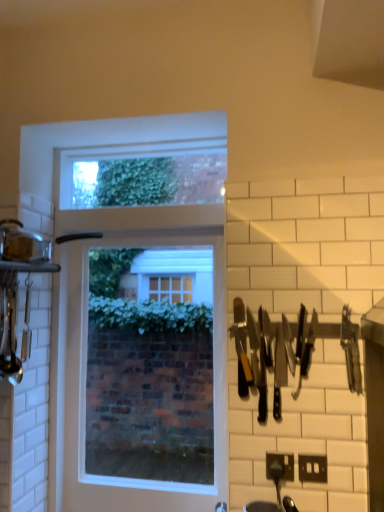
Question: Is black plastic electric outlet at lower right at the left side of black plastic knives at right?

Choices:
 (A) no
 (B) yes

Answer: (A)

Question: Does black plastic electric outlet at lower right have a greater height compared to black plastic knives at right?

Choices:
 (A) yes
 (B) no

Answer: (B)

Question: Is black plastic electric outlet at lower right placed right next to black plastic knives at right?

Choices:
 (A) yes
 (B) no

Answer: (B)

Question: Is black plastic electric outlet at lower right looking in the opposite direction of black plastic knives at right?

Choices:
 (A) no
 (B) yes

Answer: (A)

Question: Is there a large distance between black plastic electric outlet at lower right and black plastic knives at right?

Choices:
 (A) yes
 (B) no

Answer: (B)

Question: Is black plastic knives at right surrounded by black plastic electric outlet at lower right?

Choices:
 (A) no
 (B) yes

Answer: (A)

Question: Is black plastic knives at right further to camera compared to clear glass window at center?

Choices:
 (A) yes
 (B) no

Answer: (B)

Question: Can you confirm if black plastic knives at right is smaller than clear glass window at center?

Choices:
 (A) no
 (B) yes

Answer: (B)

Question: From the image's perspective, does black plastic knives at right appear higher than clear glass window at center?

Choices:
 (A) yes
 (B) no

Answer: (A)

Question: From a real-world perspective, is black plastic knives at right located beneath clear glass window at center?

Choices:
 (A) no
 (B) yes

Answer: (A)

Question: Does black plastic knives at right have a lesser height compared to clear glass window at center?

Choices:
 (A) yes
 (B) no

Answer: (A)

Question: Is clear glass window at center at the back of black plastic knives at right?

Choices:
 (A) no
 (B) yes

Answer: (A)

Question: Does clear glass window at center come behind black plastic knives at right?

Choices:
 (A) yes
 (B) no

Answer: (A)